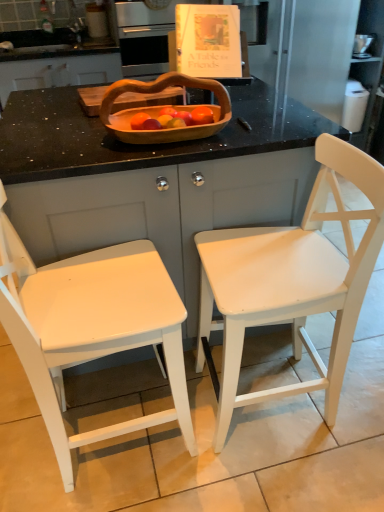
At what (x,y) coordinates should I click in order to perform the action: click on vacant space to the left of wooden basket at center. Please return your answer as a coordinate pair (x, y). The image size is (384, 512). Looking at the image, I should click on (69, 142).